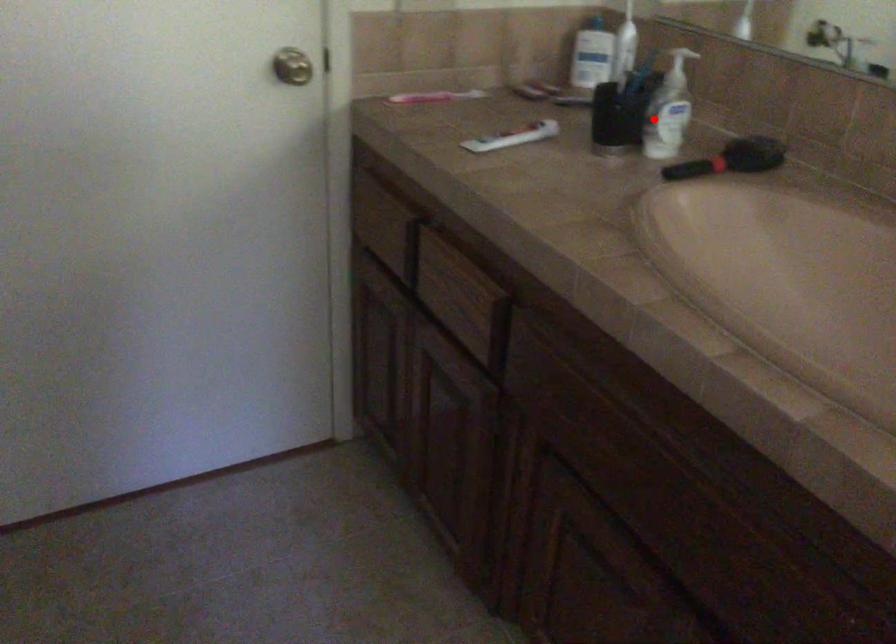
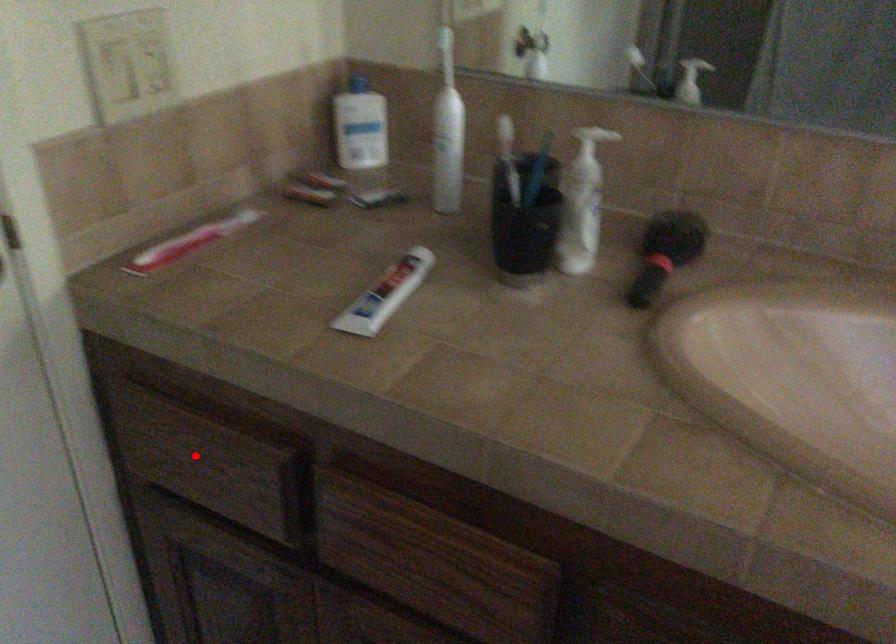
I am providing you with two images of the same scene from different viewpoints. A red point is marked on the first image and another point is marked on the second image. Do the highlighted points in image1 and image2 indicate the same real-world spot?

No